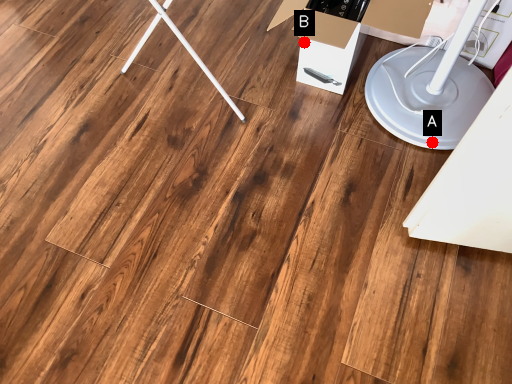
Question: Two points are circled on the image, labeled by A and B beside each circle. Among these points, which one is farthest from the camera?

Choices:
 (A) A is further
 (B) B is further

Answer: (B)